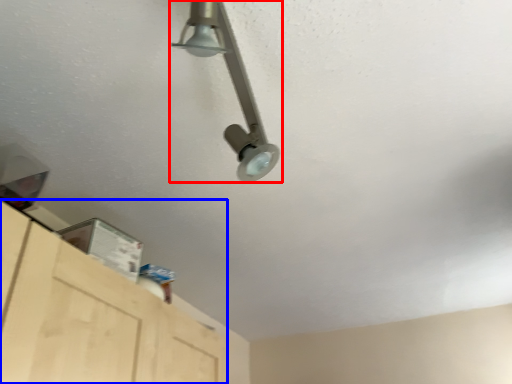
Question: Among these objects, which one is farthest to the camera, lamp (highlighted by a red box) or cabinetry (highlighted by a blue box)?

Choices:
 (A) lamp
 (B) cabinetry

Answer: (B)